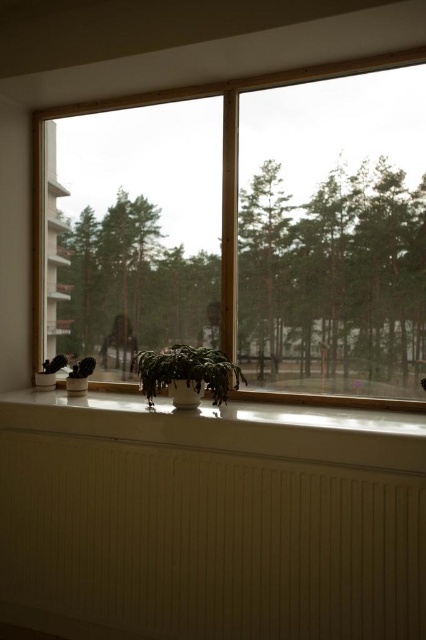
Question: Where is matte white windowsill at center located in relation to white glossy window sill at lower center in the image?

Choices:
 (A) right
 (B) left

Answer: (A)

Question: Which point appears farthest from the camera in this image?

Choices:
 (A) (322, 547)
 (B) (342, 461)
 (C) (236, 250)

Answer: (C)

Question: Considering the relative positions of white glossy window sill at lower center and green matte plant at center in the image provided, where is white glossy window sill at lower center located with respect to green matte plant at center?

Choices:
 (A) below
 (B) above

Answer: (A)

Question: Which point is farther from the camera taking this photo?

Choices:
 (A) (131, 362)
 (B) (135, 356)
 (C) (129, 401)
 (D) (157, 449)

Answer: (A)

Question: Can you confirm if white glossy window sill at lower center is positioned to the right of green matte plant at center?

Choices:
 (A) yes
 (B) no

Answer: (A)

Question: Which point is closer to the camera?

Choices:
 (A) (354, 612)
 (B) (351, 189)
 (C) (152, 372)

Answer: (A)